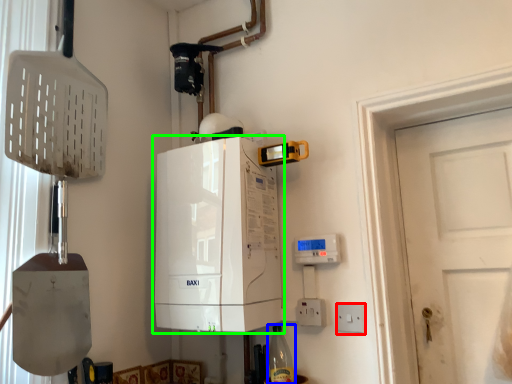
Question: Based on their relative distances, which object is nearer to electric outlet (highlighted by a red box)? Choose from bottle (highlighted by a blue box) and home appliance (highlighted by a green box).

Choices:
 (A) bottle
 (B) home appliance

Answer: (A)